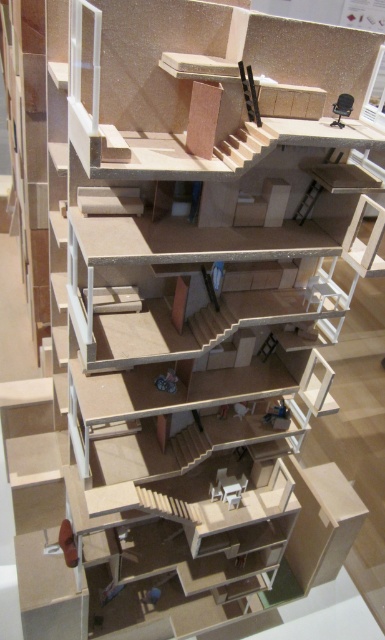
Between wooden stairs at upper center and wooden at center, which one appears on the right side from the viewer's perspective?

From the viewer's perspective, wooden stairs at upper center appears more on the right side.

Is point (219, 141) positioned before point (137, 212)?

Yes, it is in front of point (137, 212).

Image resolution: width=385 pixels, height=640 pixels. Find the location of `wooden stairs at upper center`. wooden stairs at upper center is located at coordinates (246, 147).

Does wooden stairs at upper center lie behind wooden staircase at center?

No.

Locate an element on the screen. The height and width of the screenshot is (640, 385). wooden stairs at upper center is located at coordinates (246, 147).

Does wooden at center appear on the left side of wooden staircase at center?

Correct, you'll find wooden at center to the left of wooden staircase at center.

Is point (90, 196) behind point (190, 436)?

No, it is in front of (190, 436).

You are a GUI agent. You are given a task and a screenshot of the screen. Output one action in this format:
    pyautogui.click(x=<x>, y=<y>)
    Task: Click on the wooden at center
    The width and height of the screenshot is (385, 640).
    Given the screenshot: What is the action you would take?
    pyautogui.click(x=108, y=200)